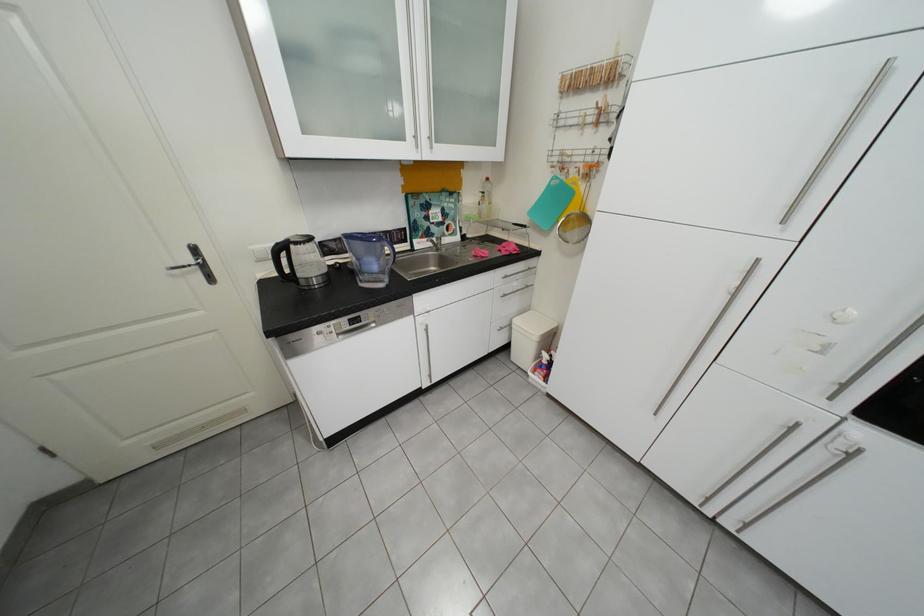
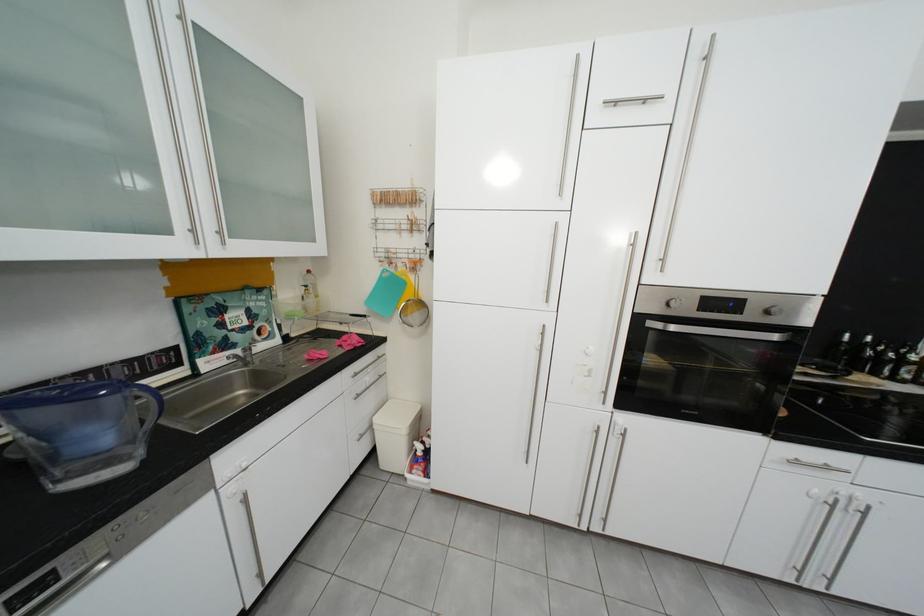
Locate, in the second image, the point that corresponds to point (579, 183) in the first image.

(409, 275)